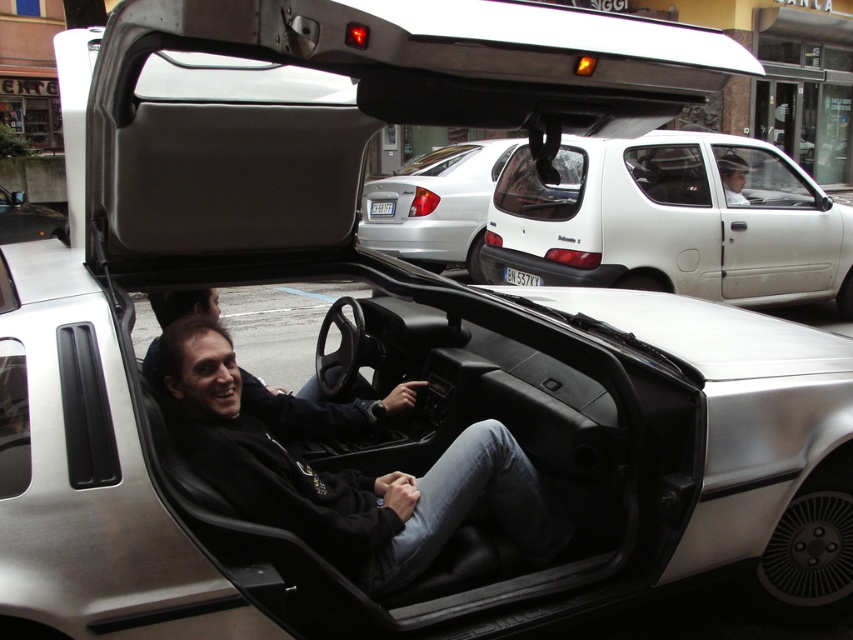
You are a delivery person who needs to place a package on the black leather jacket at center. Given that the car door is open, can you access the jacket easily?

The black leather jacket at center is located at point (346, 476), which is likely within reach from the open car door, so yes, you can access it easily.

You are a delivery person who needs to deliver a package to the car with the open door. You see the black plastic license plate at center and the white plastic license plate at center. Which license plate should you look at to determine which car is closer to you?

The black plastic license plate at center is in front of the white plastic license plate at center, so the car with the black plastic license plate at center is closer to you.

You are a delivery person who needs to place a package between the black leather jacket at center and the matte black jacket at center in the car. The package is 28 inches long. Will it fit between them?

The distance between the black leather jacket at center and the matte black jacket at center is 27.72 inches. Since the package is 28 inches long, it will not fit between them as it is slightly longer than the available space.